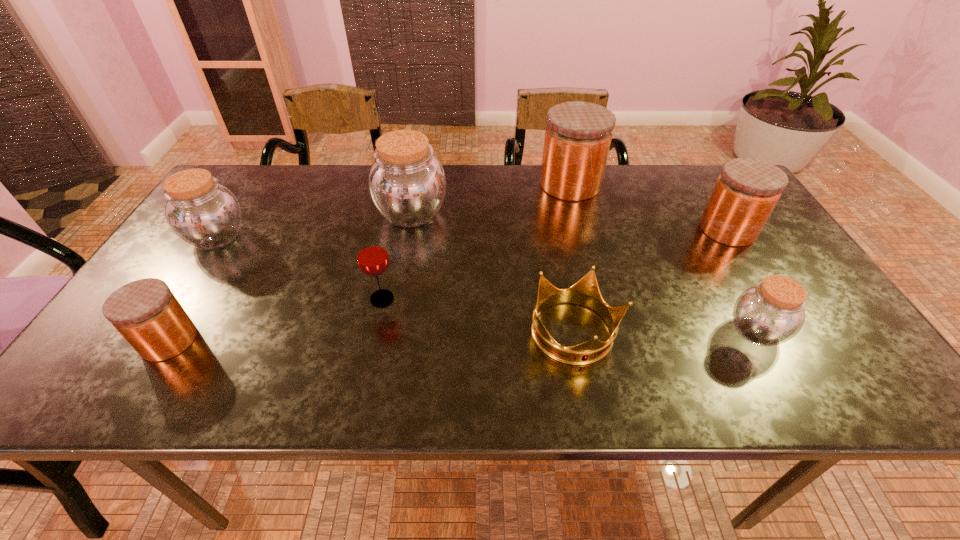
I want to click on vacant space located on the left of the nearest brown jar, so click(662, 332).

At what (x,y) coordinates should I click in order to perform the action: click on free region located on the right of the gold crown. Please return your answer as a coordinate pair (x, y). Image resolution: width=960 pixels, height=540 pixels. Looking at the image, I should click on (721, 333).

Identify the location of object located in the near edge section of the desktop. (586, 292).

Where is `free space at the far edge`? This screenshot has width=960, height=540. free space at the far edge is located at coordinates (364, 198).

Image resolution: width=960 pixels, height=540 pixels. In the image, there is a desktop. What are the coordinates of `blank space at the near edge` in the screenshot? It's located at pos(297,389).

Where is `free space at the left edge of the desktop`? The width and height of the screenshot is (960, 540). free space at the left edge of the desktop is located at coordinates (89, 363).

Locate an element on the screen. The height and width of the screenshot is (540, 960). vacant space at the right edge of the desktop is located at coordinates (821, 344).

You are a GUI agent. You are given a task and a screenshot of the screen. Output one action in this format:
    pyautogui.click(x=<x>, y=<y>)
    Task: Click on the vacant space at the far left corner of the desktop
    
    Given the screenshot: What is the action you would take?
    pyautogui.click(x=229, y=179)

I want to click on vacant region at the near left corner of the desktop, so click(x=81, y=379).

I want to click on vacant space at the far right corner of the desktop, so click(x=696, y=176).